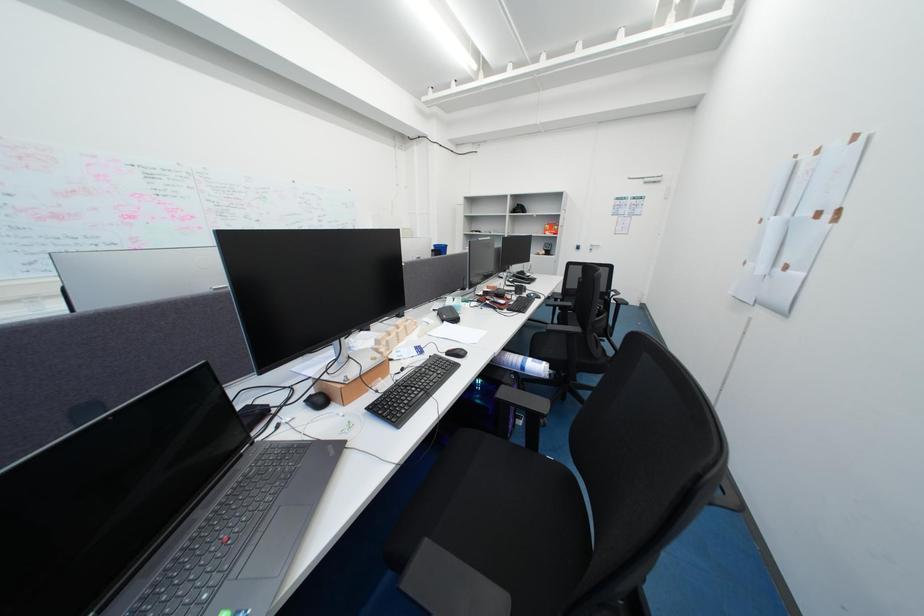
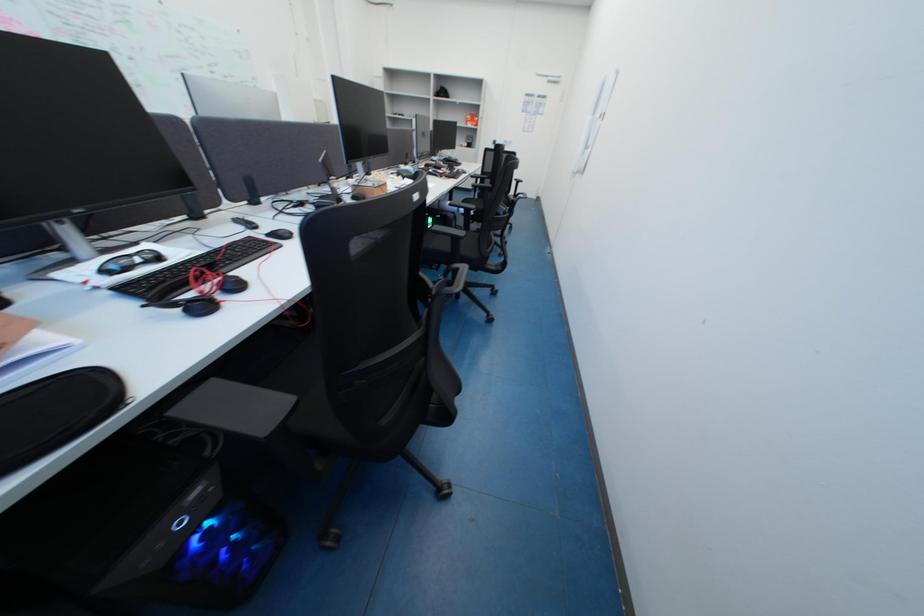
Looking at this image, what movement of the cameraman would produce the second image?

The cameraman walked toward left, backward.